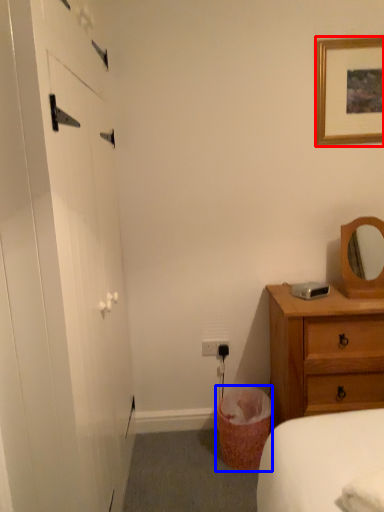
Question: Which object is closer to the camera taking this photo, picture frame (highlighted by a red box) or laundry basket (highlighted by a blue box)?

Choices:
 (A) picture frame
 (B) laundry basket

Answer: (B)